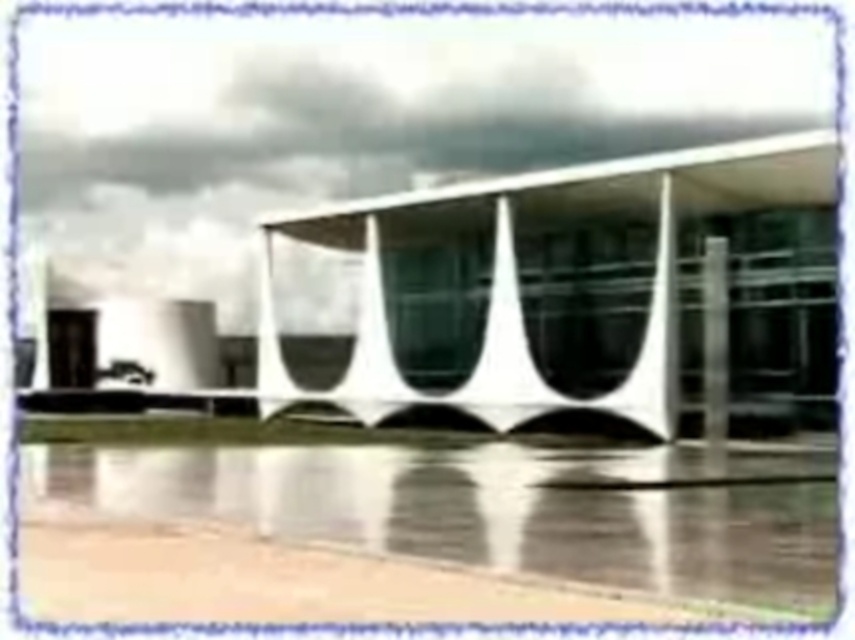
Question: Does white glass building at center lie behind black glass pillar at right?

Choices:
 (A) yes
 (B) no

Answer: (B)

Question: Which of the following is the farthest from the observer?

Choices:
 (A) white glass building at center
 (B) black glass pillar at right

Answer: (B)

Question: Is the position of white glass building at center less distant than that of black glass pillar at right?

Choices:
 (A) yes
 (B) no

Answer: (A)

Question: Among these objects, which one is farthest from the camera?

Choices:
 (A) black glass pillar at right
 (B) white glass building at center

Answer: (A)

Question: Is white glass building at center above black glass pillar at right?

Choices:
 (A) yes
 (B) no

Answer: (A)